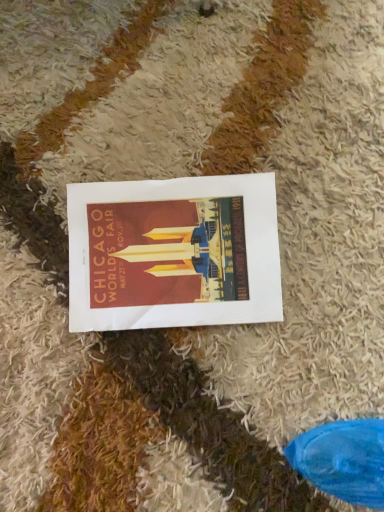
You are a GUI agent. You are given a task and a screenshot of the screen. Output one action in this format:
    pyautogui.click(x=<x>, y=<y>)
    Task: Click on the matte paper poster at center
    
    Given the screenshot: What is the action you would take?
    pyautogui.click(x=173, y=253)

What do you see at coordinates (173, 253) in the screenshot?
I see `matte paper poster at center` at bounding box center [173, 253].

The width and height of the screenshot is (384, 512). I want to click on matte paper poster at center, so click(173, 253).